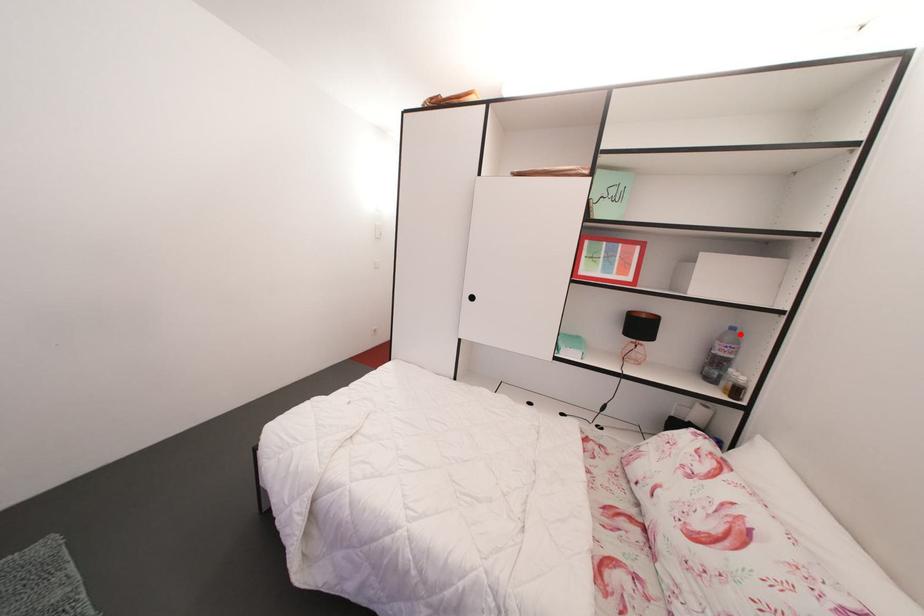
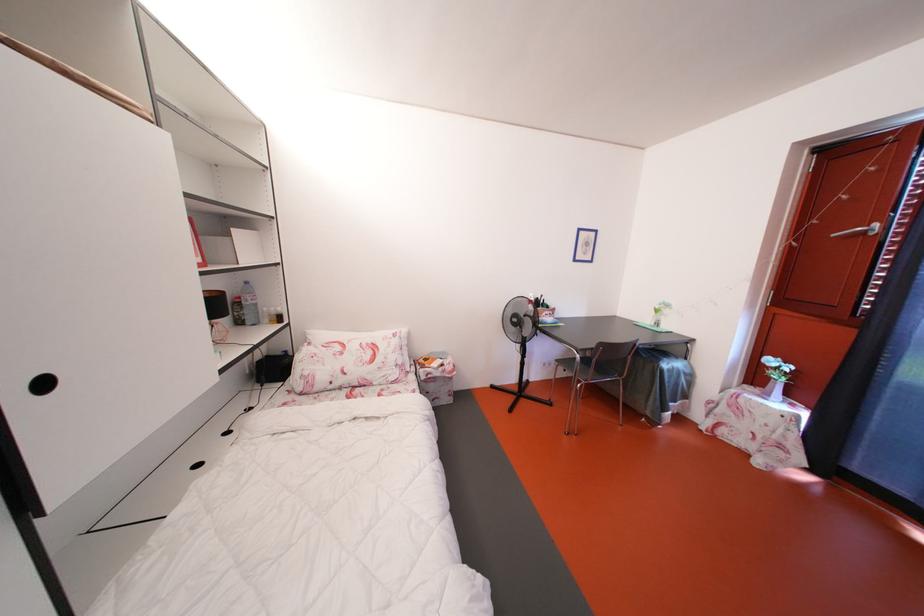
Question: I am providing you with two images of the same scene from different viewpoints. A red point is shown in image1. For the corresponding object point in image2, is it positioned nearer or farther from the camera?

Choices:
 (A) Nearer
 (B) Farther

Answer: (A)